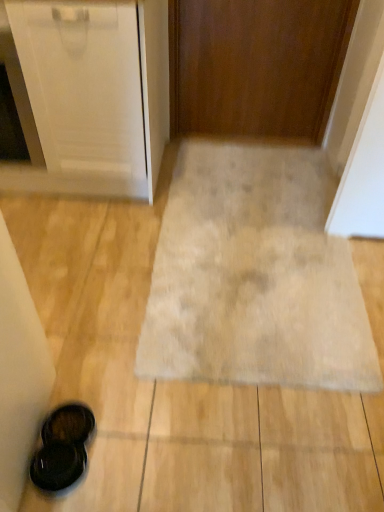
Question: Is wooden door at center in contact with black matte sandals at lower left?

Choices:
 (A) yes
 (B) no

Answer: (B)

Question: Is wooden door at center to the right of black matte sandals at lower left from the viewer's perspective?

Choices:
 (A) yes
 (B) no

Answer: (A)

Question: Is wooden door at center positioned far away from black matte sandals at lower left?

Choices:
 (A) yes
 (B) no

Answer: (A)

Question: Does wooden door at center have a greater width compared to black matte sandals at lower left?

Choices:
 (A) yes
 (B) no

Answer: (B)

Question: Is wooden door at center taller than black matte sandals at lower left?

Choices:
 (A) no
 (B) yes

Answer: (B)

Question: Is point (322, 339) closer or farther from the camera than point (54, 424)?

Choices:
 (A) closer
 (B) farther

Answer: (B)

Question: Considering the positions of beige carpet at center and black matte sandals at lower left in the image, is beige carpet at center bigger or smaller than black matte sandals at lower left?

Choices:
 (A) big
 (B) small

Answer: (A)

Question: From a real-world perspective, is beige carpet at center physically located above or below black matte sandals at lower left?

Choices:
 (A) below
 (B) above

Answer: (A)

Question: Choose the correct answer: Is beige carpet at center inside black matte sandals at lower left or outside it?

Choices:
 (A) outside
 (B) inside

Answer: (A)

Question: Considering the positions of black matte sandals at lower left and wooden door at center in the image, is black matte sandals at lower left wider or thinner than wooden door at center?

Choices:
 (A) thin
 (B) wide

Answer: (B)

Question: Considering the positions of black matte sandals at lower left and wooden door at center in the image, is black matte sandals at lower left bigger or smaller than wooden door at center?

Choices:
 (A) small
 (B) big

Answer: (A)

Question: From the image's perspective, is black matte sandals at lower left positioned above or below wooden door at center?

Choices:
 (A) above
 (B) below

Answer: (B)

Question: In the image, is black matte sandals at lower left on the left side or the right side of wooden door at center?

Choices:
 (A) right
 (B) left

Answer: (B)

Question: In terms of height, does beige carpet at center look taller or shorter compared to wooden door at center?

Choices:
 (A) tall
 (B) short

Answer: (B)

Question: Looking at their shapes, would you say beige carpet at center is wider or thinner than wooden door at center?

Choices:
 (A) thin
 (B) wide

Answer: (B)